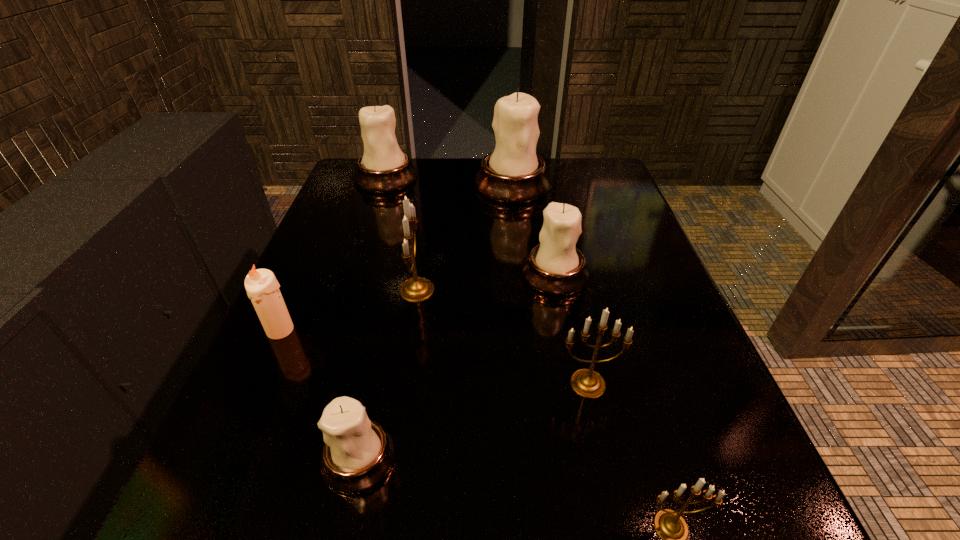
Locate an element on the screen. The width and height of the screenshot is (960, 540). the tallest object is located at coordinates (513, 173).

You are a GUI agent. You are given a task and a screenshot of the screen. Output one action in this format:
    pyautogui.click(x=<x>, y=<y>)
    Task: Click on the tallest candelabrum
    
    Given the screenshot: What is the action you would take?
    pyautogui.click(x=513, y=173)

At what (x,y) coordinates should I click in order to perform the action: click on the second biggest white candle holder. Please return your answer as a coordinate pair (x, y). The width and height of the screenshot is (960, 540). Looking at the image, I should click on (383, 168).

This screenshot has width=960, height=540. What are the coordinates of `the farthest gold candelabrum` in the screenshot? It's located at (416, 289).

This screenshot has width=960, height=540. Find the location of `the biggest gold candelabrum`. the biggest gold candelabrum is located at coordinates (416, 289).

You are a GUI agent. You are given a task and a screenshot of the screen. Output one action in this format:
    pyautogui.click(x=<x>, y=<y>)
    Task: Click on the third biggest white candle holder
    The width and height of the screenshot is (960, 540).
    Given the screenshot: What is the action you would take?
    (x=556, y=267)

You are a GUI agent. You are given a task and a screenshot of the screen. Output one action in this format:
    pyautogui.click(x=<x>, y=<y>)
    Task: Click on the second farthest gold candelabrum
    The width and height of the screenshot is (960, 540).
    Given the screenshot: What is the action you would take?
    tap(585, 382)

This screenshot has width=960, height=540. What are the coordinates of `the sixth farthest object` in the screenshot? It's located at (585, 382).

At what (x,y) coordinates should I click in order to perform the action: click on candle. Please return your answer as a coordinate pair (x, y). The image size is (960, 540). Looking at the image, I should click on (262, 287).

Identify the location of the sixth farthest candelabrum. (358, 453).